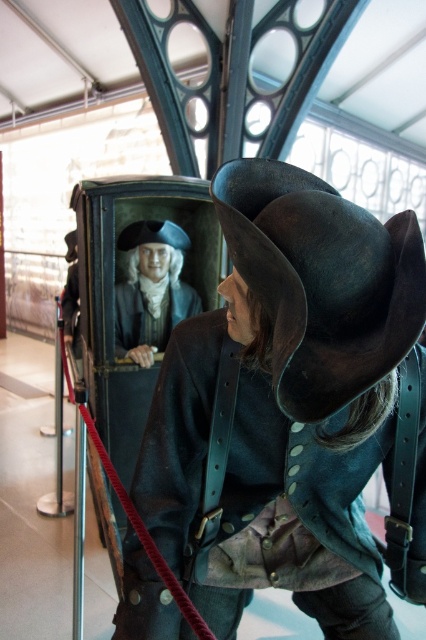
Question: Estimate the real-world distances between objects in this image. Which object is farther from the matte black bust at upper center?

Choices:
 (A) dark brown leather hat at center
 (B) matte black hat at center

Answer: (A)

Question: Is matte black bust at upper center above matte black hat at center?

Choices:
 (A) yes
 (B) no

Answer: (B)

Question: Can you confirm if dark brown leather hat at center is positioned below matte black bust at upper center?

Choices:
 (A) no
 (B) yes

Answer: (B)

Question: Which of these objects is positioned closest to the matte black bust at upper center?

Choices:
 (A) matte black hat at center
 (B) dark brown leather hat at center

Answer: (A)

Question: Which point is farther to the camera?

Choices:
 (A) (150, 321)
 (B) (388, 269)
 (C) (138, 230)

Answer: (A)

Question: Is matte black bust at upper center behind matte black hat at center?

Choices:
 (A) no
 (B) yes

Answer: (A)